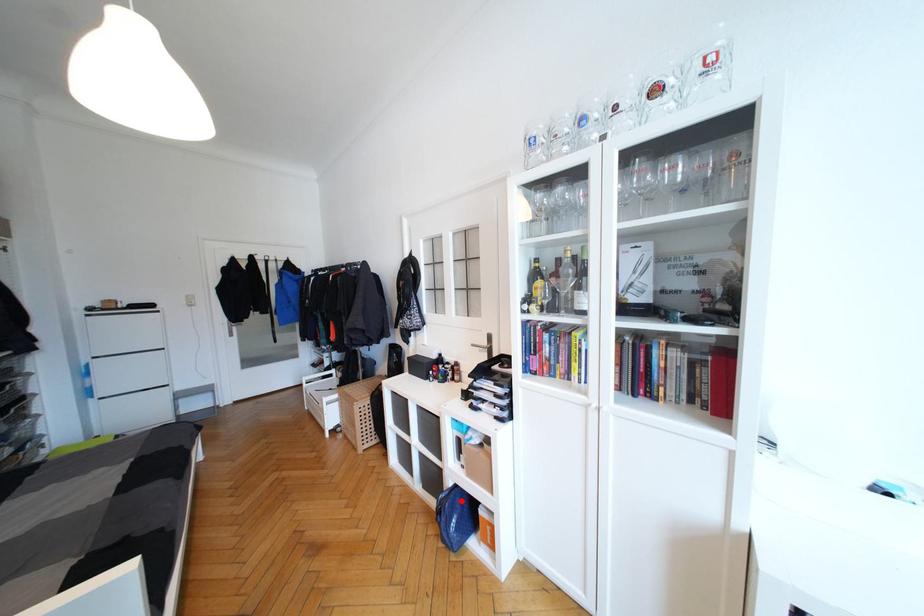
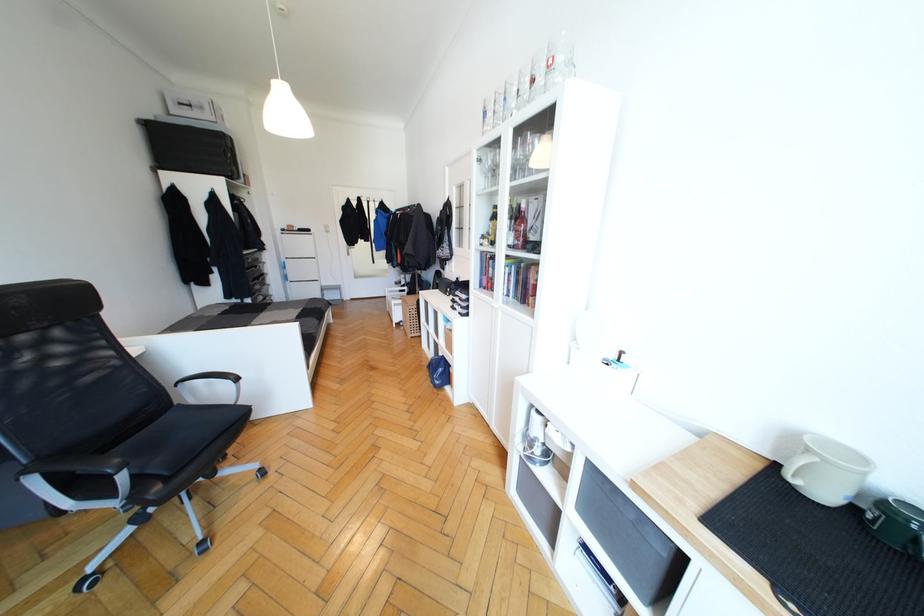
Question: I am providing you with two images of the same scene from different viewpoints. A red point is shown in image1. For the corresponding object point in image2, is it positioned nearer or farther from the camera?

Choices:
 (A) Nearer
 (B) Farther

Answer: (A)